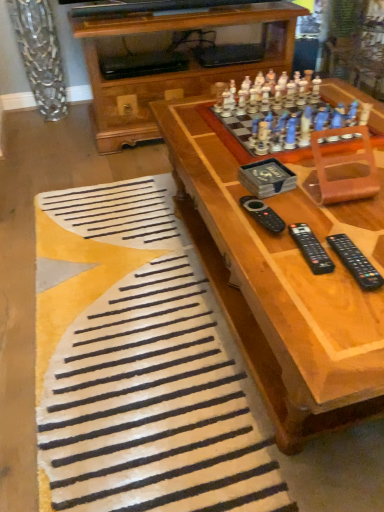
The height and width of the screenshot is (512, 384). Identify the location of vacant area to the right of black plastic remote at center, arranged as the 3th remote when viewed from the right. (321, 215).